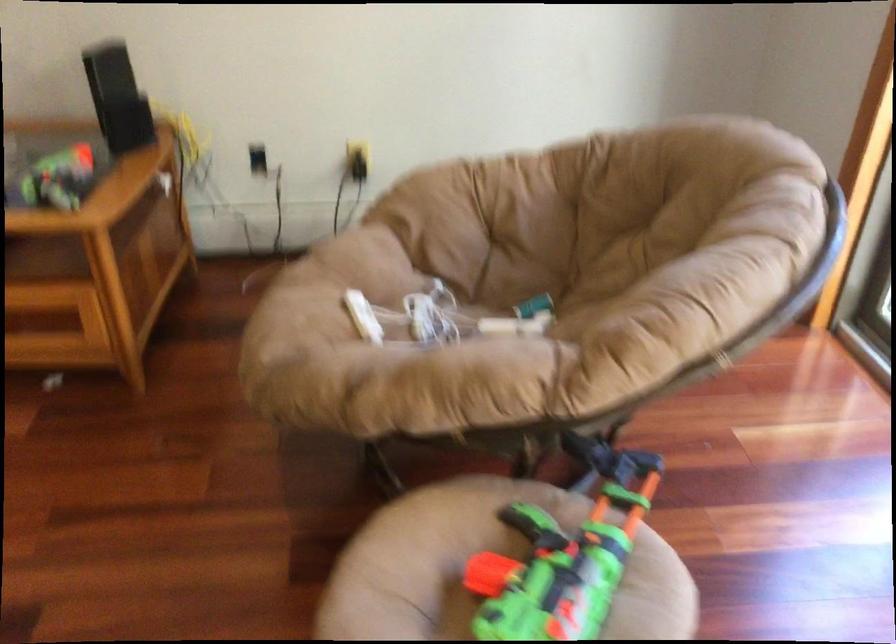
What are the coordinates of `toy gun handle` in the screenshot? It's located at (530, 520).